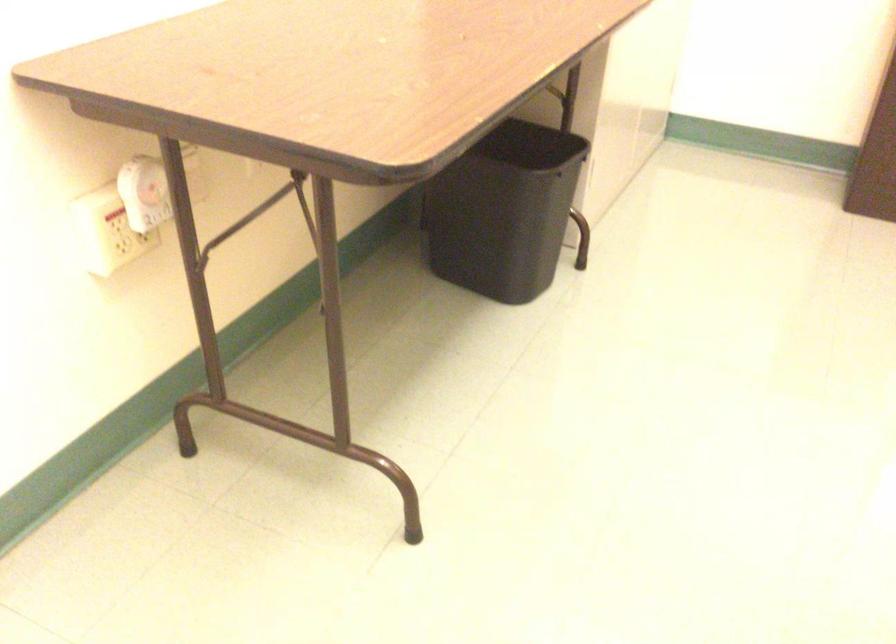
Where is `black trash can`? black trash can is located at coordinates (504, 211).